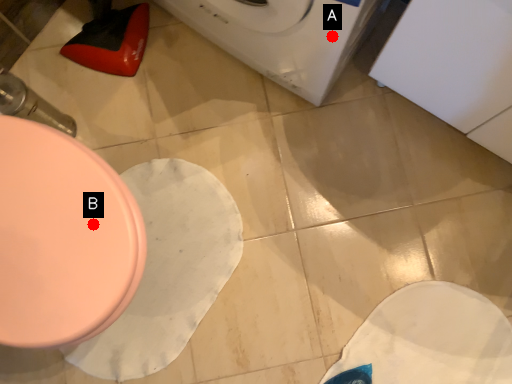
Question: Two points are circled on the image, labeled by A and B beside each circle. Which of the following is the farthest from the observer?

Choices:
 (A) A is further
 (B) B is further

Answer: (A)